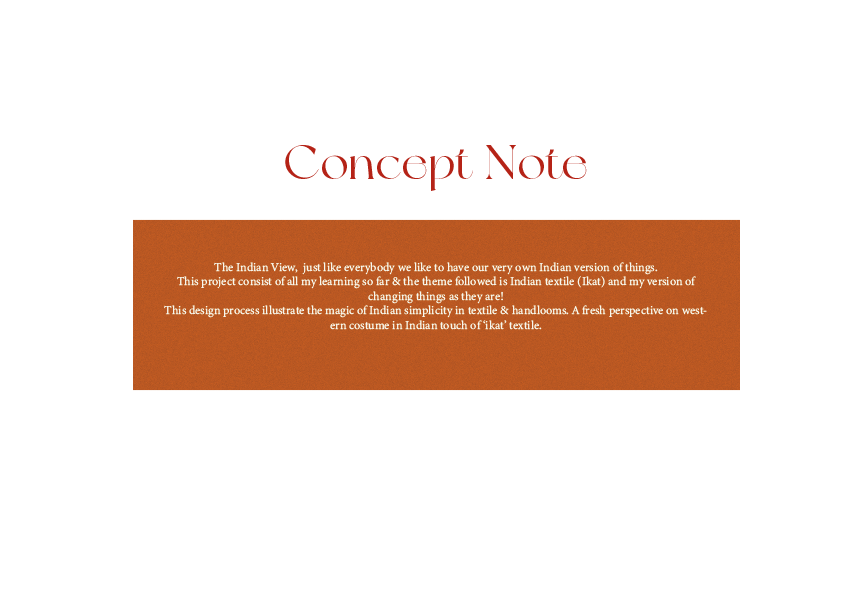
You are a GUI agent. You are given a task and a screenshot of the screen. Output one action in this format:
    pyautogui.click(x=<x>, y=<y>)
    Task: Click on the corner
    The height and width of the screenshot is (596, 843).
    Given the screenshot: What is the action you would take?
    pyautogui.click(x=733, y=221), pyautogui.click(x=726, y=388), pyautogui.click(x=132, y=229), pyautogui.click(x=133, y=378)